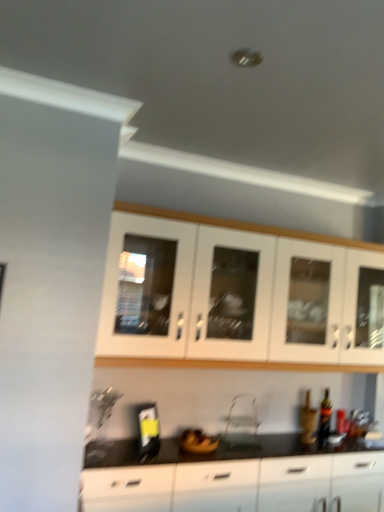
This screenshot has width=384, height=512. I want to click on free location to the right of clear plastic folding chair at center, so click(x=278, y=446).